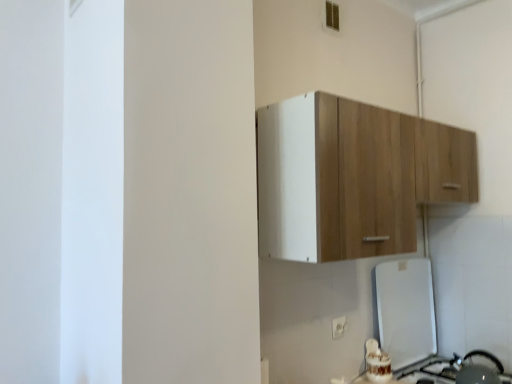
Question: Considering the relative sizes of wooden cabinet at upper center and white plastic electric outlet at lower center in the image provided, is wooden cabinet at upper center thinner than white plastic electric outlet at lower center?

Choices:
 (A) no
 (B) yes

Answer: (A)

Question: Considering the relative sizes of wooden cabinet at upper center and white plastic electric outlet at lower center in the image provided, is wooden cabinet at upper center bigger than white plastic electric outlet at lower center?

Choices:
 (A) no
 (B) yes

Answer: (B)

Question: Is the position of wooden cabinet at upper center less distant than that of white plastic electric outlet at lower center?

Choices:
 (A) no
 (B) yes

Answer: (B)

Question: From the image's perspective, is wooden cabinet at upper center on top of white plastic electric outlet at lower center?

Choices:
 (A) no
 (B) yes

Answer: (B)

Question: Can you confirm if wooden cabinet at upper center is positioned to the right of white plastic electric outlet at lower center?

Choices:
 (A) yes
 (B) no

Answer: (A)

Question: Is wooden cabinet at upper center facing away from white plastic electric outlet at lower center?

Choices:
 (A) yes
 (B) no

Answer: (B)

Question: Does white plastic electric outlet at lower center have a greater height compared to metallic silver kettle at lower right, the 1th appliance from the bottom?

Choices:
 (A) yes
 (B) no

Answer: (B)

Question: Is white plastic electric outlet at lower center to the right of metallic silver kettle at lower right, arranged as the 2th appliance when viewed from the top, from the viewer's perspective?

Choices:
 (A) yes
 (B) no

Answer: (B)

Question: Is white plastic electric outlet at lower center facing towards metallic silver kettle at lower right, the 1th appliance from the bottom?

Choices:
 (A) no
 (B) yes

Answer: (A)

Question: Is white plastic electric outlet at lower center at the left side of metallic silver kettle at lower right, the 1th appliance from the bottom?

Choices:
 (A) no
 (B) yes

Answer: (B)

Question: Considering the relative positions of white plastic electric outlet at lower center and metallic silver kettle at lower right, the 1th appliance from the bottom, in the image provided, is white plastic electric outlet at lower center in front of metallic silver kettle at lower right, the 1th appliance from the bottom,?

Choices:
 (A) yes
 (B) no

Answer: (B)

Question: From the image's perspective, is white plastic electric outlet at lower center above metallic silver kettle at lower right, arranged as the 2th appliance when viewed from the top?

Choices:
 (A) yes
 (B) no

Answer: (A)

Question: Is wooden cabinet at upper center oriented away from metallic silver kettle at lower right, arranged as the 2th appliance when viewed from the top?

Choices:
 (A) yes
 (B) no

Answer: (B)